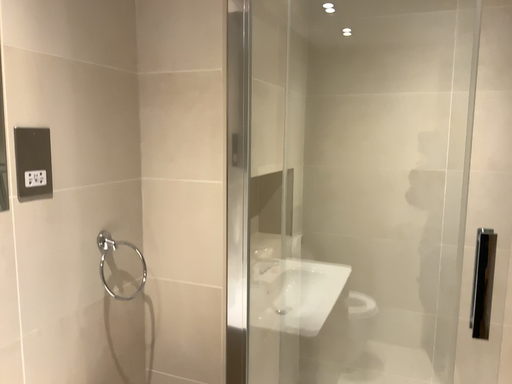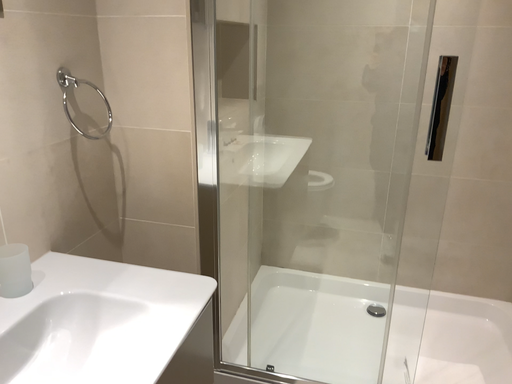
Question: Which way did the camera rotate in the video?

Choices:
 (A) rotated upward
 (B) rotated downward

Answer: (B)